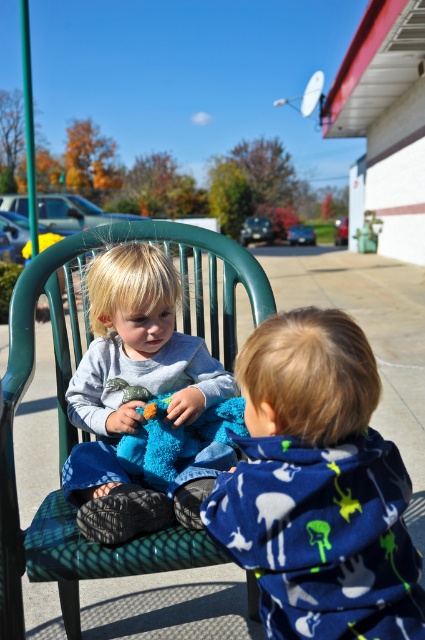
Can you confirm if blue fleece hoodie at center is positioned below green fabric rocking chair at center?

Incorrect, blue fleece hoodie at center is not positioned below green fabric rocking chair at center.

Between blue fleece hoodie at center and green fabric rocking chair at center, which one appears on the right side from the viewer's perspective?

blue fleece hoodie at center is more to the right.

Image resolution: width=425 pixels, height=640 pixels. Find the location of `blue fleece hoodie at center`. blue fleece hoodie at center is located at coordinates (317, 486).

You are a GUI agent. You are given a task and a screenshot of the screen. Output one action in this format:
    pyautogui.click(x=<x>, y=<y>)
    Task: Click on the blue fleece hoodie at center
    
    Given the screenshot: What is the action you would take?
    pyautogui.click(x=317, y=486)

Who is positioned more to the right, green fabric rocking chair at center or soft gray sweater at center?

soft gray sweater at center

Which is behind, point (195, 531) or point (178, 378)?

Positioned behind is point (178, 378).

Identify the location of green fabric rocking chair at center. This screenshot has height=640, width=425. (57, 468).

Does blue fleece hoodie at center appear on the left side of soft gray sweater at center?

In fact, blue fleece hoodie at center is to the right of soft gray sweater at center.

At what (x,y) coordinates should I click in order to perform the action: click on blue fleece hoodie at center. Please return your answer as a coordinate pair (x, y). The height and width of the screenshot is (640, 425). Looking at the image, I should click on (317, 486).